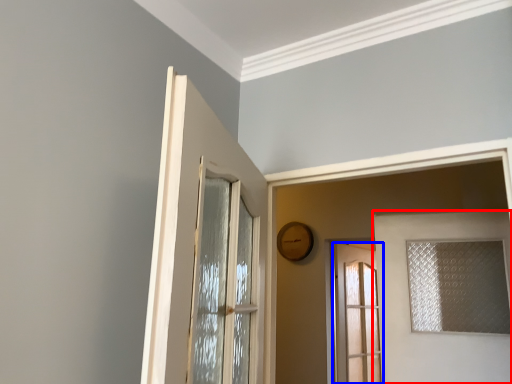
Question: Which object appears farthest to the camera in this image, door (highlighted by a red box) or door (highlighted by a blue box)?

Choices:
 (A) door
 (B) door

Answer: (B)